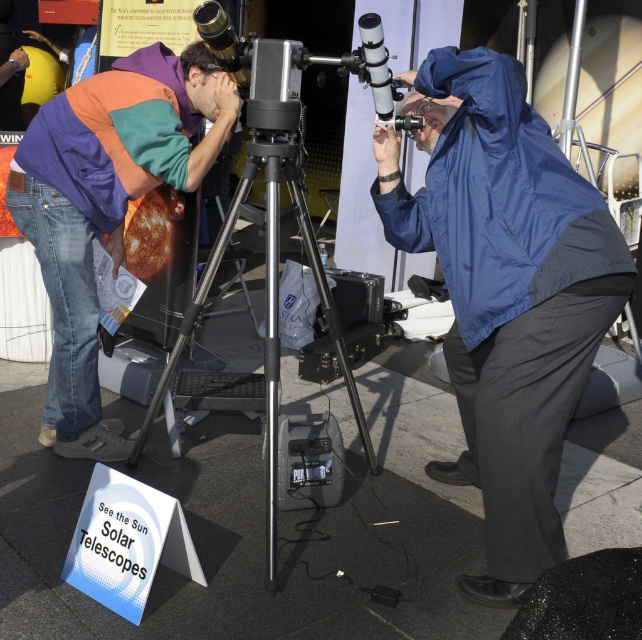
Does blue smooth jacket at center lie behind silver metallic tripod at center?

No, blue smooth jacket at center is in front of silver metallic tripod at center.

Is blue smooth jacket at center shorter than silver metallic tripod at center?

Correct, blue smooth jacket at center is not as tall as silver metallic tripod at center.

Where is `blue smooth jacket at center`? Image resolution: width=642 pixels, height=640 pixels. blue smooth jacket at center is located at coordinates (498, 196).

Between point (64, 156) and point (453, 49), which one is positioned behind?

The point (64, 156) is behind.

Find the location of a particular element. multicolored fleece jacket at left is located at coordinates (105, 205).

This screenshot has width=642, height=640. Find the location of `multicolored fleece jacket at left`. multicolored fleece jacket at left is located at coordinates (105, 205).

Can you confirm if multicolored fleece jacket at left is positioned below silver metallic tripod at center?

No.

At what (x,y) coordinates should I click in order to perform the action: click on multicolored fleece jacket at left. Please return your answer as a coordinate pair (x, y). Looking at the image, I should click on (105, 205).